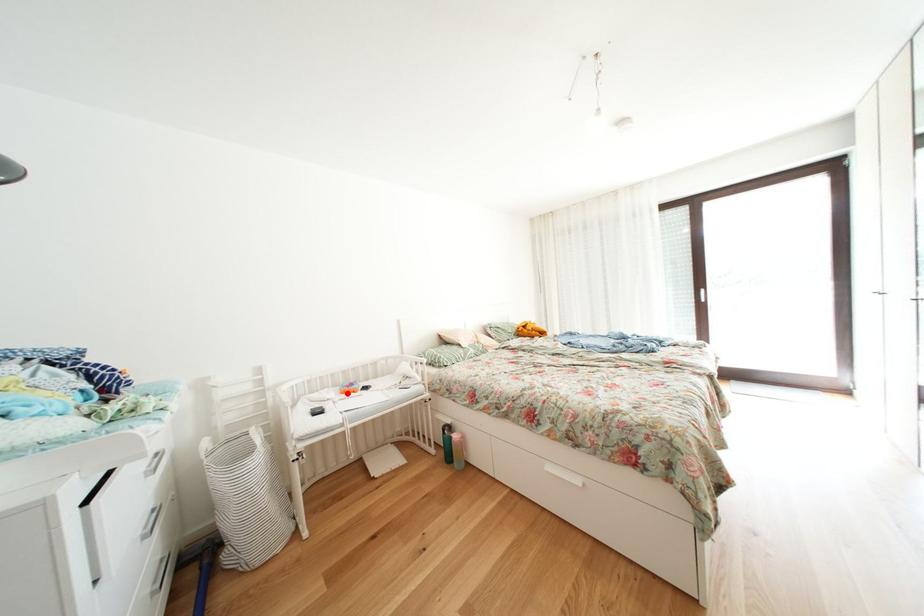
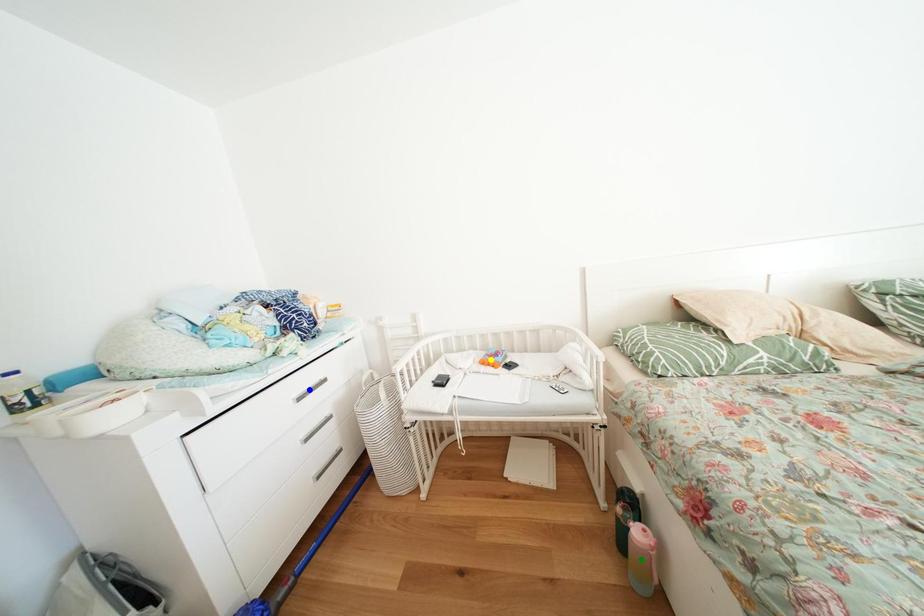
Question: I am providing you with two images of the same scene from different viewpoints. A red point is marked on the first image. You are given multiple points on the second image. Which point in image 2 represents the same 3d spot as the red point in image 1?

Choices:
 (A) green point
 (B) blue point
 (C) yellow point

Answer: (C)